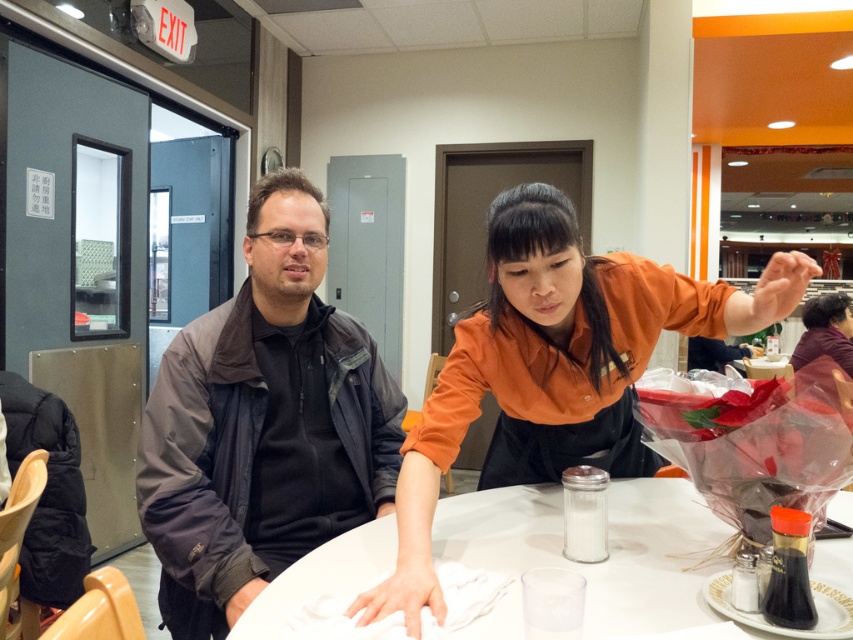
You are a waiter in a restaurant and need to deliver a drink to the customer wearing the orange shirt at center. The path to their seat goes past the dark gray jacket at center. Is there enough space between the two to walk through comfortably?

The dark gray jacket at center is positioned on the left side of orange shirt at center. Since the jacket is to the left of the shirt, there should be sufficient space between them for the waiter to walk through comfortably to reach the orange shirt at center.

You are a waiter in a restaurant. You need to deliver a drink to the customer wearing the orange shirt at center without disturbing the person in the dark gray jacket at center. How should you approach the table?

The orange shirt at center is behind dark gray jacket at center, so you should approach from the back side of the dark gray jacket at center to reach the orange shirt at center without disturbing the seated customer.